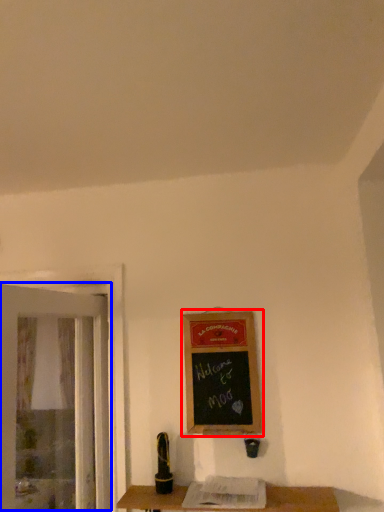
Question: Which point is further to the camera, bulletin board (highlighted by a red box) or screen door (highlighted by a blue box)?

Choices:
 (A) bulletin board
 (B) screen door

Answer: (A)